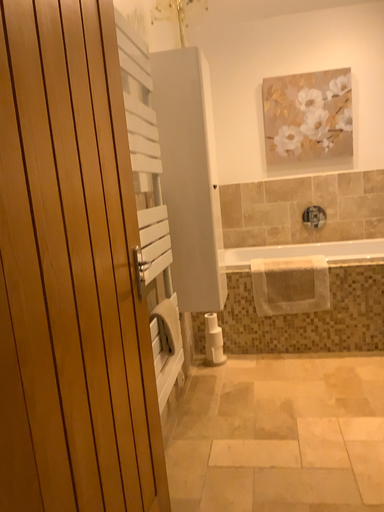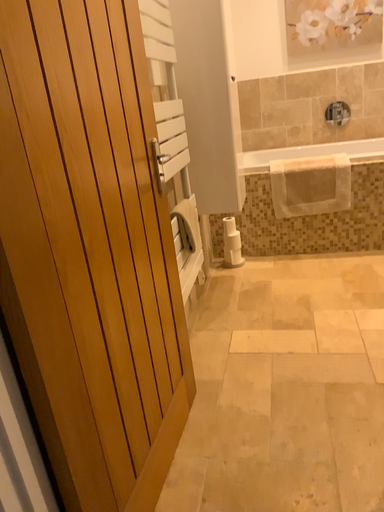
Question: How did the camera likely rotate when shooting the video?

Choices:
 (A) rotated upward
 (B) rotated downward

Answer: (B)